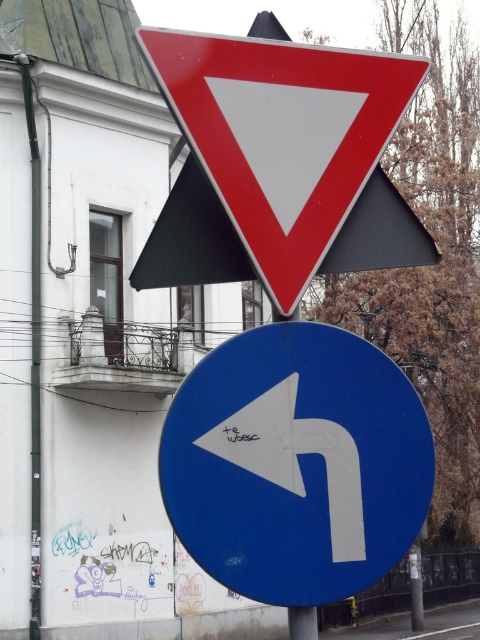
You are a driver approaching an intersection and see the blue glossy arrow at center and the white matte arrow at center on a road sign. Which arrow is visible on top of the other?

The blue glossy arrow at center is positioned over the white matte arrow at center, making it the top arrow visible.

You are standing at a crosswalk and see the blue glossy arrow at center. If you need to reach it within 5 meters to press a button for pedestrian signal, can you reach it from where you are?

The blue glossy arrow at center is 3.98 meters away from the camera, so yes, you can reach it within 5 meters to press the pedestrian signal button.

You are a pedestrian standing at the point with coordinates point (x=345, y=490) and want to walk towards the point with coordinates point (x=277, y=408). According to the image, will you be moving towards the building or away from it?

Point (x=345, y=490) is in front of point (x=277, y=408), so moving from point (x=345, y=490) to point (x=277, y=408) means you are moving away from the building.